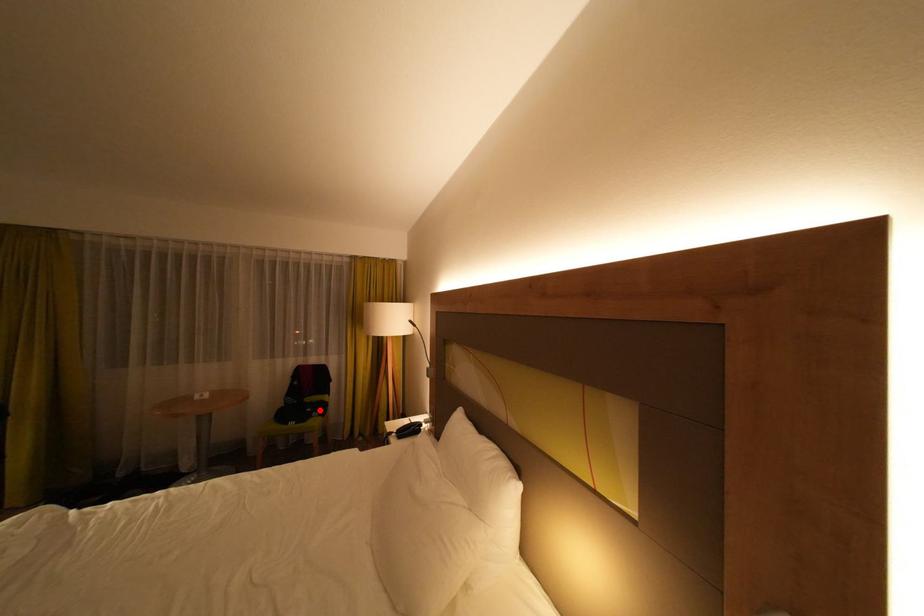
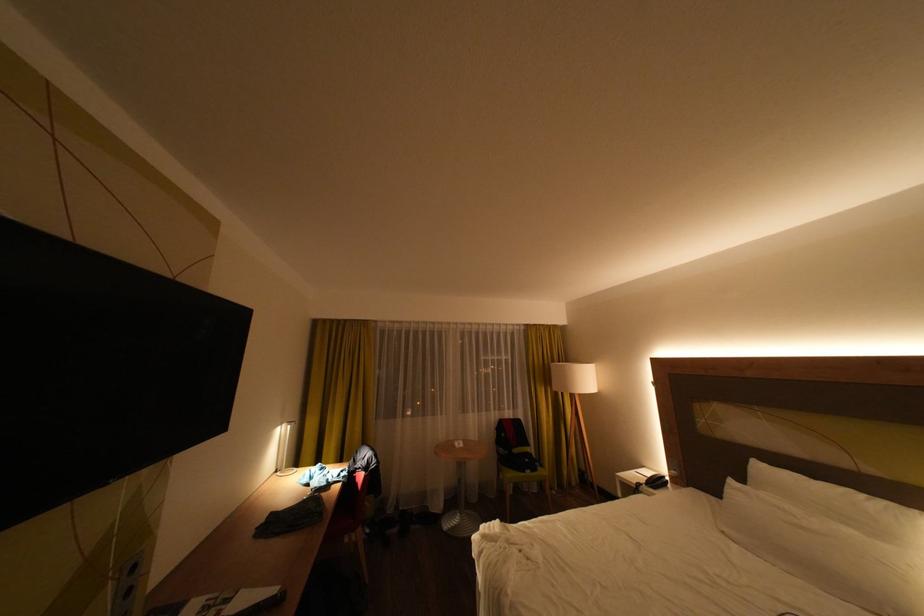
Locate, in the second image, the point that corresponds to the highlighted location in the first image.

(538, 460)